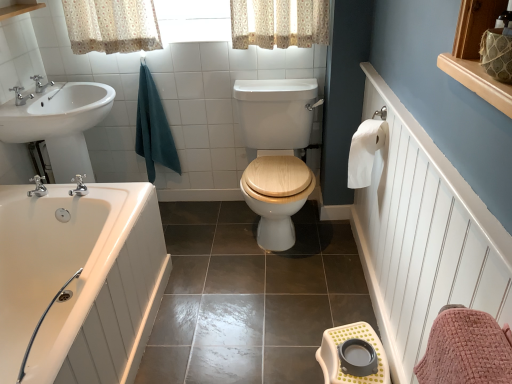
This screenshot has width=512, height=384. What do you see at coordinates (340, 359) in the screenshot?
I see `yellow polka dot plastic step stool at lower right` at bounding box center [340, 359].

The image size is (512, 384). What do you see at coordinates (19, 8) in the screenshot? I see `white wood balustrade at upper left` at bounding box center [19, 8].

Image resolution: width=512 pixels, height=384 pixels. Find the location of `white wood balustrade at upper left`. white wood balustrade at upper left is located at coordinates (19, 8).

Describe the element at coordinates (153, 128) in the screenshot. This screenshot has height=384, width=512. I see `teal cotton towel at upper left` at that location.

Find the location of a particular element. The width and height of the screenshot is (512, 384). white paper at right is located at coordinates (365, 151).

Describe the element at coordinates (423, 237) in the screenshot. I see `white textured radiator at right` at that location.

The width and height of the screenshot is (512, 384). What do you see at coordinates (79, 281) in the screenshot? I see `white glossy bathtub at lower left` at bounding box center [79, 281].

In order to face white glossy bathtub at lower left, should I rotate leftwards or rightwards?

To face it directly, rotate left by 26.989 degrees.

Measure the distance between white glossy bathtub at lower left and camera.

The distance of white glossy bathtub at lower left from camera is 1.60 meters.

Locate an element on the screen. yellow polka dot plastic step stool at lower right is located at coordinates (340, 359).

Is wooden at center at the left side of white paper at right?

Correct, you'll find wooden at center to the left of white paper at right.

Is the position of wooden at center more distant than that of white paper at right?

Yes, the depth of wooden at center is greater than that of white paper at right.

From the image's perspective, is wooden at center positioned above or below white paper at right?

Based on their image positions, wooden at center is located beneath white paper at right.

What's the angular difference between wooden at center and white paper at right's facing directions?

The facing directions of wooden at center and white paper at right are 90 degrees apart.

Is white glossy bathtub at lower left behind white textured radiator at right?

That is True.

Does white glossy bathtub at lower left have a lesser height compared to white textured radiator at right?

Yes.

Would you say white glossy bathtub at lower left is a long distance from white textured radiator at right?

They are positioned close to each other.

Which is farther, (335,379) or (7,8)?

Point (7,8)

How many degrees apart are the facing directions of yellow polka dot plastic step stool at lower right and white wood balustrade at upper left?

180 degrees separate the facing orientations of yellow polka dot plastic step stool at lower right and white wood balustrade at upper left.

From the image's perspective, is yellow polka dot plastic step stool at lower right located beneath white wood balustrade at upper left?

Indeed, from the image's perspective, yellow polka dot plastic step stool at lower right is shown beneath white wood balustrade at upper left.

From their relative heights in the image, would you say yellow polka dot plastic step stool at lower right is taller or shorter than white wood balustrade at upper left?

Considering their sizes, yellow polka dot plastic step stool at lower right has more height than white wood balustrade at upper left.

Looking at this image, does brushed metal faucet at upper left, the first tap in the top-to-bottom sequence, appear on the left side of white glossy bathtub at lower left?

Yes, brushed metal faucet at upper left, the first tap in the top-to-bottom sequence, is to the left of white glossy bathtub at lower left.

Which of these two, brushed metal faucet at upper left, the second tap viewed from the front, or white glossy bathtub at lower left, stands taller?

white glossy bathtub at lower left.

You are a GUI agent. You are given a task and a screenshot of the screen. Output one action in this format:
    pyautogui.click(x=<x>, y=<y>)
    Task: Click on the bathtub in front of the brushed metal faucet at upper left, positioned as the 2th tap in bottom-to-top order
    This screenshot has height=384, width=512.
    Given the screenshot: What is the action you would take?
    pyautogui.click(x=79, y=281)

From a real-world perspective, does white wood balustrade at upper left stand above brushed metal faucet at upper left, positioned as the 2th tap in bottom-to-top order?

Yes, from a real-world perspective, white wood balustrade at upper left is on top of brushed metal faucet at upper left, positioned as the 2th tap in bottom-to-top order.

You are a GUI agent. You are given a task and a screenshot of the screen. Output one action in this format:
    pyautogui.click(x=<x>, y=<y>)
    Task: Click on the 2nd tap directly beneath the white wood balustrade at upper left (from a real-world perspective)
    The width and height of the screenshot is (512, 384).
    Given the screenshot: What is the action you would take?
    pyautogui.click(x=40, y=83)

In terms of height, does white wood balustrade at upper left look taller or shorter compared to brushed metal faucet at upper left, the second tap viewed from the front?

Clearly, white wood balustrade at upper left is shorter compared to brushed metal faucet at upper left, the second tap viewed from the front.

Considering the relative positions of white wood balustrade at upper left and brushed metal faucet at upper left, the second tap viewed from the front, in the image provided, is white wood balustrade at upper left behind brushed metal faucet at upper left, the second tap viewed from the front,?

No, the depth of white wood balustrade at upper left is less than that of brushed metal faucet at upper left, the second tap viewed from the front.

Does brushed metal faucet at upper left, the second tap viewed from the front, have a larger size compared to teal cotton towel at upper left?

Actually, brushed metal faucet at upper left, the second tap viewed from the front, might be smaller than teal cotton towel at upper left.

From the image's perspective, would you say teal cotton towel at upper left is shown under wooden at center?

No.

Can you tell me how much teal cotton towel at upper left and wooden at center differ in facing direction?

There is a 0.00083-degree angle between the facing directions of teal cotton towel at upper left and wooden at center.

Relative to wooden at center, is teal cotton towel at upper left in front or behind?

Clearly, teal cotton towel at upper left is behind wooden at center.

Which is correct: teal cotton towel at upper left is inside wooden at center, or outside of it?

teal cotton towel at upper left exists outside the volume of wooden at center.

The width and height of the screenshot is (512, 384). In order to click on toilet that is under the white paper at right (from a real-world perspective) in this screenshot , I will do `click(276, 112)`.

Where is `radiator above the white glossy bathtub at lower left (from a real-world perspective)`? The width and height of the screenshot is (512, 384). radiator above the white glossy bathtub at lower left (from a real-world perspective) is located at coordinates (423, 237).

From the image, which object appears to be farther from white wood balustrade at upper left, teal cotton towel at upper left or wooden at center?

wooden at center is further to white wood balustrade at upper left.

Which object lies further to the anchor point white textured radiator at right, white glossy bathtub at lower left or white wood balustrade at upper left?

white wood balustrade at upper left is further to white textured radiator at right.

Considering their positions, is white glossy bathtub at lower left positioned closer to silver metallic faucet at upper left, placed as the 2th tap when sorted from top to bottom, than white wood balustrade at upper left?

white wood balustrade at upper left is positioned closer to the anchor silver metallic faucet at upper left, placed as the 2th tap when sorted from top to bottom.

Which object lies nearer to the anchor point white glossy sink at left, white textured radiator at right or white paper at right?

Among the two, white paper at right is located nearer to white glossy sink at left.

Looking at the image, which one is located further to white glossy sink at left, white paper at right or yellow polka dot plastic step stool at lower right?

Based on the image, yellow polka dot plastic step stool at lower right appears to be further to white glossy sink at left.

When comparing their distances from wooden at center, does white glossy sink at left or yellow polka dot plastic step stool at lower right seem further?

white glossy sink at left is positioned further to the anchor wooden at center.

Based on their spatial positions, is white textured radiator at right or white paper at right further from brushed metal faucet at upper left, the first tap in the top-to-bottom sequence?

white textured radiator at right is positioned further to the anchor brushed metal faucet at upper left, the first tap in the top-to-bottom sequence.

From the image, which object appears to be nearer to yellow polka dot plastic step stool at lower right, brushed metal faucet at upper left, the first tap when ordered from back to front, or white wood balustrade at upper left?

Among the two, brushed metal faucet at upper left, the first tap when ordered from back to front, is located nearer to yellow polka dot plastic step stool at lower right.

The height and width of the screenshot is (384, 512). Find the location of `toilet located between teal cotton towel at upper left and white paper at right in the left-right direction`. toilet located between teal cotton towel at upper left and white paper at right in the left-right direction is located at coordinates (276, 112).

You are a GUI agent. You are given a task and a screenshot of the screen. Output one action in this format:
    pyautogui.click(x=<x>, y=<y>)
    Task: Click on the bathtub between brushed metal faucet at upper left, the first tap in the top-to-bottom sequence, and yellow polka dot plastic step stool at lower right
    This screenshot has height=384, width=512.
    Given the screenshot: What is the action you would take?
    pyautogui.click(x=79, y=281)

At what (x,y) coordinates should I click in order to perform the action: click on tile situated between brushed metal faucet at upper left, the second tap viewed from the front, and white paper at right from left to right. Please return your answer as a coordinate pair (x, y). Looking at the image, I should click on (250, 297).

Locate an element on the screen. The height and width of the screenshot is (384, 512). toilet between white glossy sink at left and white paper at right from left to right is located at coordinates (276, 112).